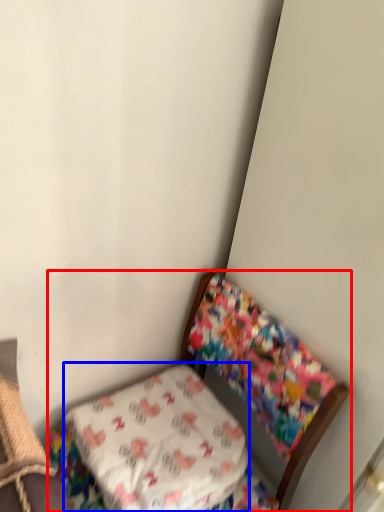
Question: Which point is closer to the camera, furniture (highlighted by a red box) or pillow (highlighted by a blue box)?

Choices:
 (A) furniture
 (B) pillow

Answer: (A)